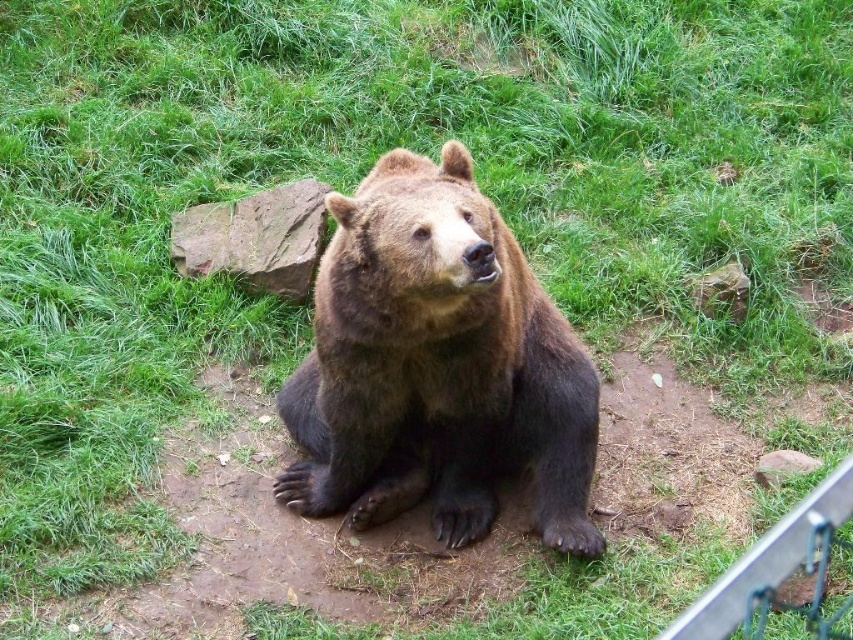
You are a wildlife photographer trying to capture a photo of the brown furry bear at center and the brown rough rock at center. You need to know which object is taller to adjust your camera angle. Can you tell me which one is taller?

The brown furry bear at center is much taller than the brown rough rock at center, so you should adjust your camera angle to look upwards when photographing the bear and downwards for the rock.